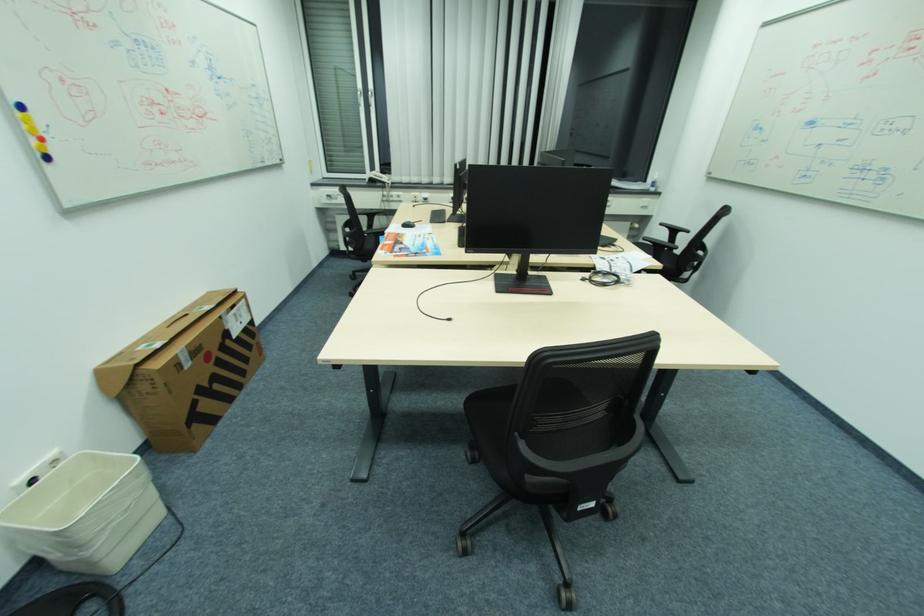
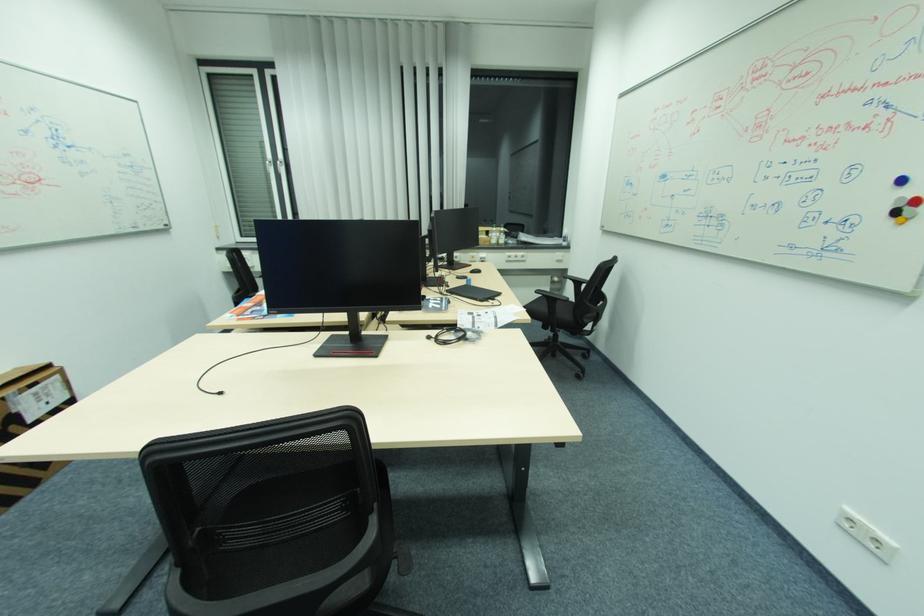
Question: The first image is from the beginning of the video and the second image is from the end. How did the camera likely rotate when shooting the video?

Choices:
 (A) Left
 (B) Right
 (C) Up
 (D) Down

Answer: (C)